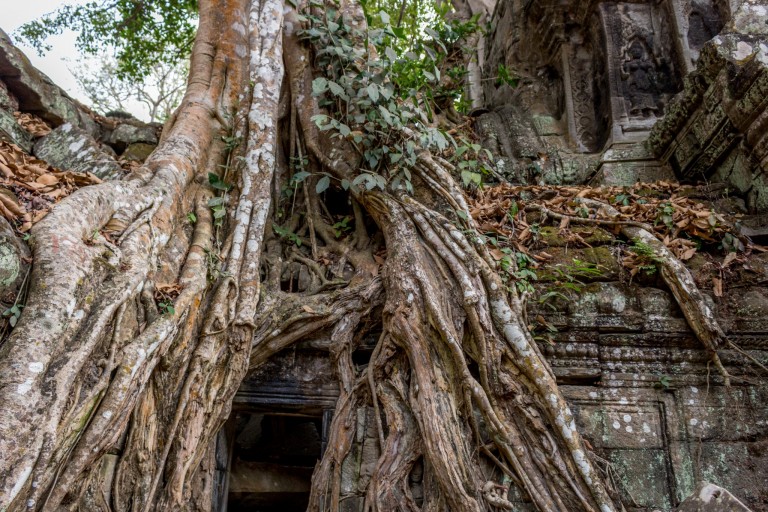
Identify the location of stone in the wall. The width and height of the screenshot is (768, 512). (682, 407).